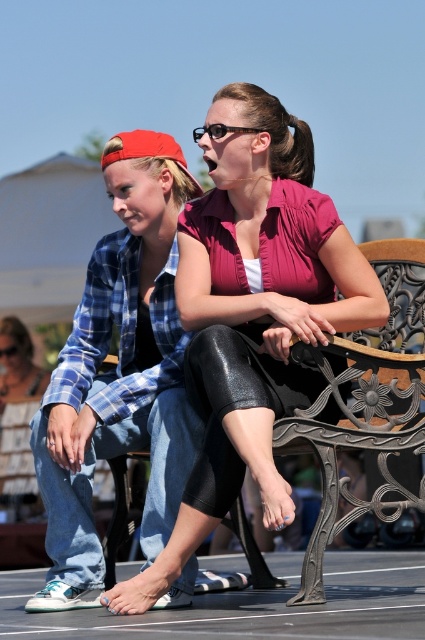
The width and height of the screenshot is (425, 640). What do you see at coordinates (252, 310) in the screenshot?
I see `matte black leggings at center` at bounding box center [252, 310].

Is point (201, 532) more distant than point (76, 589)?

No, it is not.

Where is `matte black leggings at center`? The image size is (425, 640). matte black leggings at center is located at coordinates (252, 310).

Is matte blue plaid shirt at center shorter than denim pants at lower left?

In fact, matte blue plaid shirt at center may be taller than denim pants at lower left.

What do you see at coordinates (119, 372) in the screenshot? I see `matte blue plaid shirt at center` at bounding box center [119, 372].

Is point (45, 593) positioned behind point (37, 496)?

That is False.

The width and height of the screenshot is (425, 640). I want to click on matte blue plaid shirt at center, so click(119, 372).

Can you confirm if matte black leggings at center is positioned to the left of denim pants at lower left?

Incorrect, matte black leggings at center is not on the left side of denim pants at lower left.

Where is `matte black leggings at center`? The width and height of the screenshot is (425, 640). matte black leggings at center is located at coordinates (252, 310).